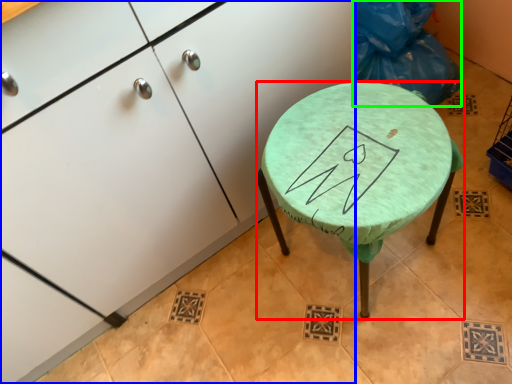
Question: Which is nearer to the stool (highlighted by a red box)? cabinetry (highlighted by a blue box) or garbage (highlighted by a green box).

Choices:
 (A) cabinetry
 (B) garbage

Answer: (A)